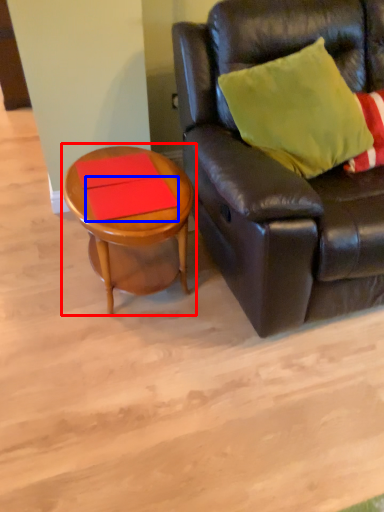
Question: Which object is closer to the camera taking this photo, coffee table (highlighted by a red box) or plank (highlighted by a blue box)?

Choices:
 (A) coffee table
 (B) plank

Answer: (A)